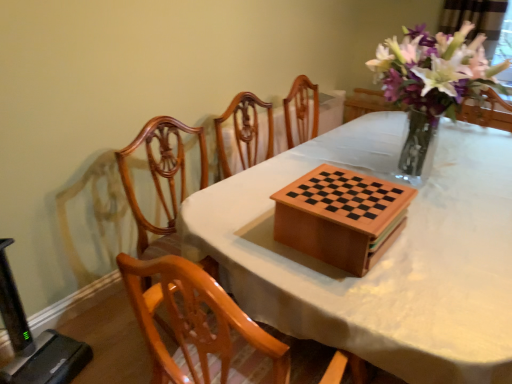
Question: Is wooden chess set at center spatially inside polished wood chair at center, or outside of it?

Choices:
 (A) inside
 (B) outside

Answer: (B)

Question: Is wooden chess set at center wider or thinner than polished wood chair at center?

Choices:
 (A) thin
 (B) wide

Answer: (A)

Question: Based on their relative distances, which object is nearer to the wooden checkered board at center?

Choices:
 (A) wooden chess set at center
 (B) polished wood chair at center
 (C) wooden table at center
 (D) translucent glass vase at upper right

Answer: (C)

Question: Considering the real-world distances, which object is farthest from the wooden table at center?

Choices:
 (A) translucent glass vase at upper right
 (B) wooden checkered board at center
 (C) wooden chess set at center
 (D) polished wood chair at center

Answer: (A)